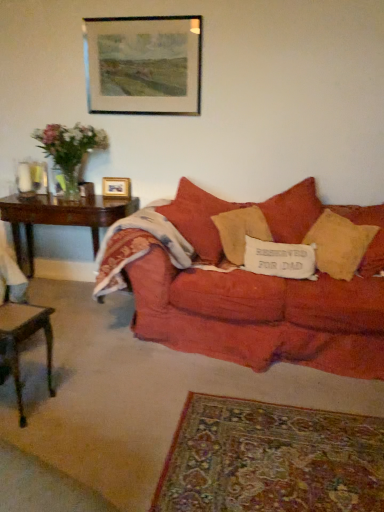
Question: Which direction should I rotate to look at textured beige pillow at center, which appears as the second pillow when viewed from the left?

Choices:
 (A) right
 (B) left

Answer: (A)

Question: Considering the relative positions of wooden picture frame at upper center, the 2th picture frame when ordered from back to front, and dark wood table at left, the second table positioned from the front, in the image provided, is wooden picture frame at upper center, the 2th picture frame when ordered from back to front, behind dark wood table at left, the second table positioned from the front,?

Choices:
 (A) no
 (B) yes

Answer: (A)

Question: Is wooden picture frame at upper center, the first picture frame when ordered from top to bottom, to the left of dark wood table at left, the second table positioned from the front, from the viewer's perspective?

Choices:
 (A) yes
 (B) no

Answer: (B)

Question: From a real-world perspective, is wooden picture frame at upper center, the 2th picture frame when ordered from back to front, located beneath dark wood table at left, the second table positioned from the front?

Choices:
 (A) yes
 (B) no

Answer: (B)

Question: Is wooden picture frame at upper center, the 2th picture frame when ordered from back to front, smaller than dark wood table at left, which ranks as the second table in bottom-to-top order?

Choices:
 (A) no
 (B) yes

Answer: (B)

Question: Is wooden picture frame at upper center, which ranks as the 1th picture frame in front-to-back order, taller than dark wood table at left, the second table positioned from the front?

Choices:
 (A) yes
 (B) no

Answer: (B)

Question: Is the depth of wooden picture frame at upper center, the 2th picture frame when ordered from back to front, less than that of dark wood table at left, which ranks as the second table in bottom-to-top order?

Choices:
 (A) yes
 (B) no

Answer: (A)

Question: Does wooden picture frame at upper center, the first picture frame when ordered from top to bottom, turn towards textured beige pillow at center, placed as the 2th pillow when sorted from right to left?

Choices:
 (A) yes
 (B) no

Answer: (B)

Question: Is wooden picture frame at upper center, which ranks as the 1th picture frame in front-to-back order, beside textured beige pillow at center, which appears as the second pillow when viewed from the left?

Choices:
 (A) no
 (B) yes

Answer: (A)

Question: Is wooden picture frame at upper center, the 2th picture frame when ordered from bottom to top, smaller than textured beige pillow at center, placed as the 2th pillow when sorted from right to left?

Choices:
 (A) yes
 (B) no

Answer: (A)

Question: Is textured beige pillow at center, which appears as the second pillow when viewed from the left, surrounded by wooden picture frame at upper center, which ranks as the 1th picture frame in front-to-back order?

Choices:
 (A) yes
 (B) no

Answer: (B)

Question: Is wooden picture frame at upper center, the 2th picture frame when ordered from back to front, looking in the opposite direction of textured beige pillow at center, which appears as the second pillow when viewed from the left?

Choices:
 (A) yes
 (B) no

Answer: (B)

Question: From a real-world perspective, is wooden picture frame at upper center, the 2th picture frame when ordered from back to front, under textured beige pillow at center, placed as the 2th pillow when sorted from right to left?

Choices:
 (A) yes
 (B) no

Answer: (B)

Question: Is matte red couch at center far away from translucent glass vase at left?

Choices:
 (A) no
 (B) yes

Answer: (B)